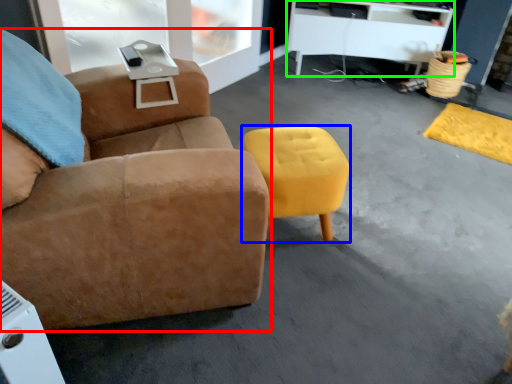
Question: Which object is the farthest from chair (highlighted by a red box)? Choose among these: stool (highlighted by a blue box) or desk (highlighted by a green box).

Choices:
 (A) stool
 (B) desk

Answer: (B)